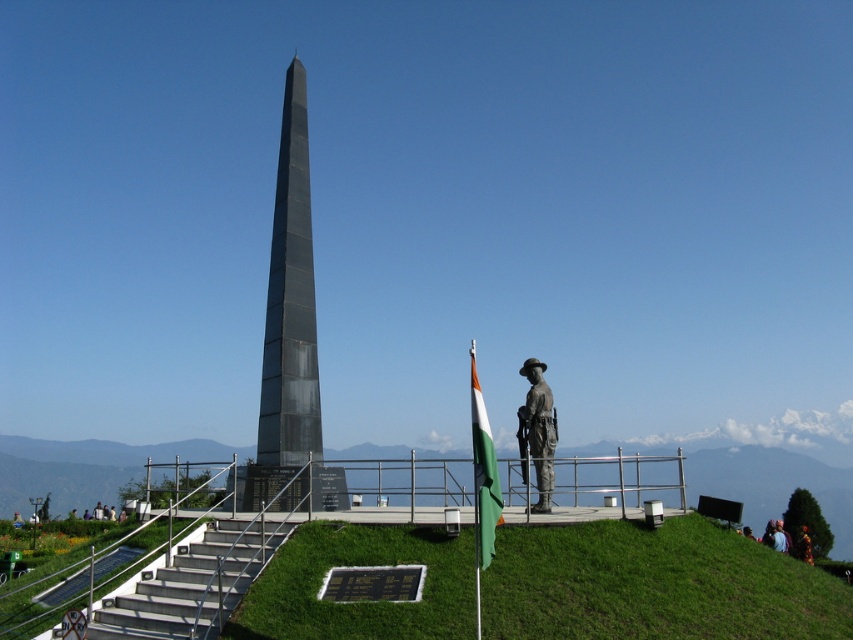
Is black polished stone obelisk at center closer to the viewer compared to metal/stainless steel stairs at lower left?

No, it is not.

Can you confirm if black polished stone obelisk at center is smaller than metal/stainless steel stairs at lower left?

Incorrect, black polished stone obelisk at center is not smaller in size than metal/stainless steel stairs at lower left.

Which is in front, point (270, 456) or point (144, 624)?

Point (144, 624)

Find the location of a particular element. The image size is (853, 640). black polished stone obelisk at center is located at coordinates (289, 337).

Does black polished stone obelisk at center lie in front of bronze statue at center?

Yes, it is in front of bronze statue at center.

Is point (292, 140) more distant than point (546, 486)?

That is True.

Is point (299, 388) farther from camera compared to point (527, 445)?

Yes, point (299, 388) is behind point (527, 445).

Locate an element on the screen. This screenshot has width=853, height=640. black polished stone obelisk at center is located at coordinates (289, 337).

Which of these two, metal/stainless steel stairs at lower left or bronze statue at center, stands taller?

With more height is bronze statue at center.

Locate an element on the screen. This screenshot has width=853, height=640. metal/stainless steel stairs at lower left is located at coordinates (192, 584).

Where is `metal/stainless steel stairs at lower left`? metal/stainless steel stairs at lower left is located at coordinates (192, 584).